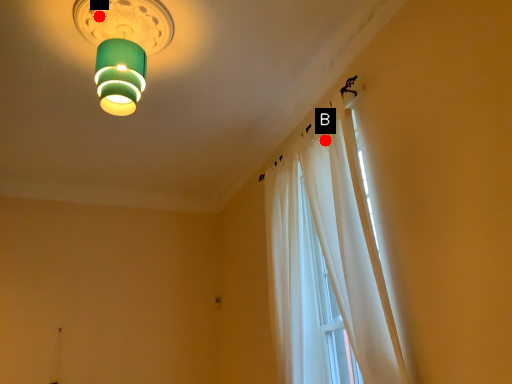
Question: Two points are circled on the image, labeled by A and B beside each circle. Which point appears closest to the camera in this image?

Choices:
 (A) A is closer
 (B) B is closer

Answer: (A)